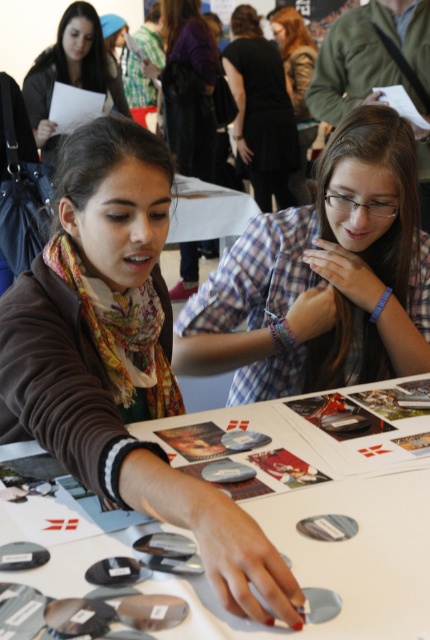
In the scene shown: You are standing 1.5 meters away from the camera. Can you reach the point at coordinates point (312, 424) with your hand?

The point at coordinates point (312, 424) is 1.18 meters away from the camera. Since you are standing 1.5 meters away from the camera, you are farther than the point, so you cannot reach it with your hand.

What is the coordinate of the metallic silver discs at center?

The metallic silver discs at center are located at coordinate point (334, 497).